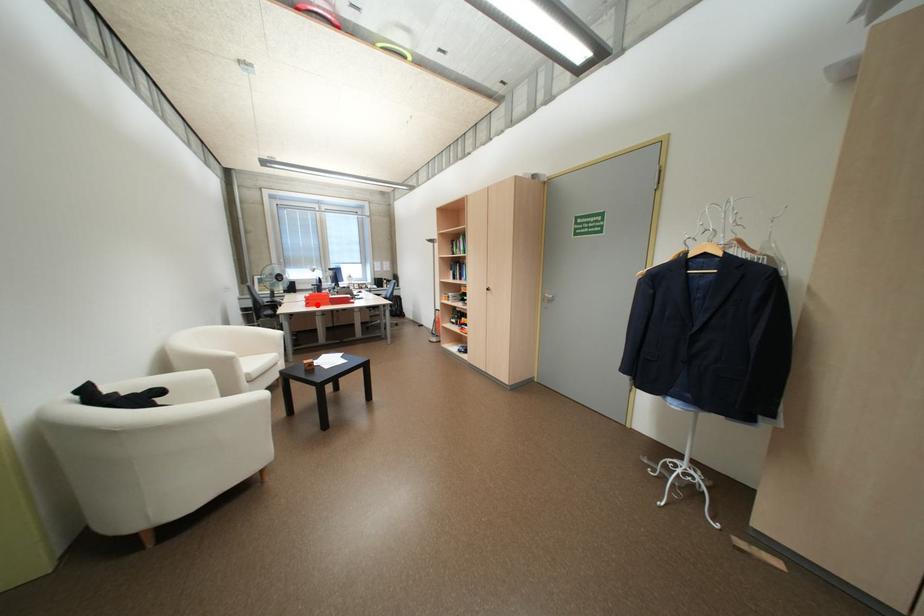
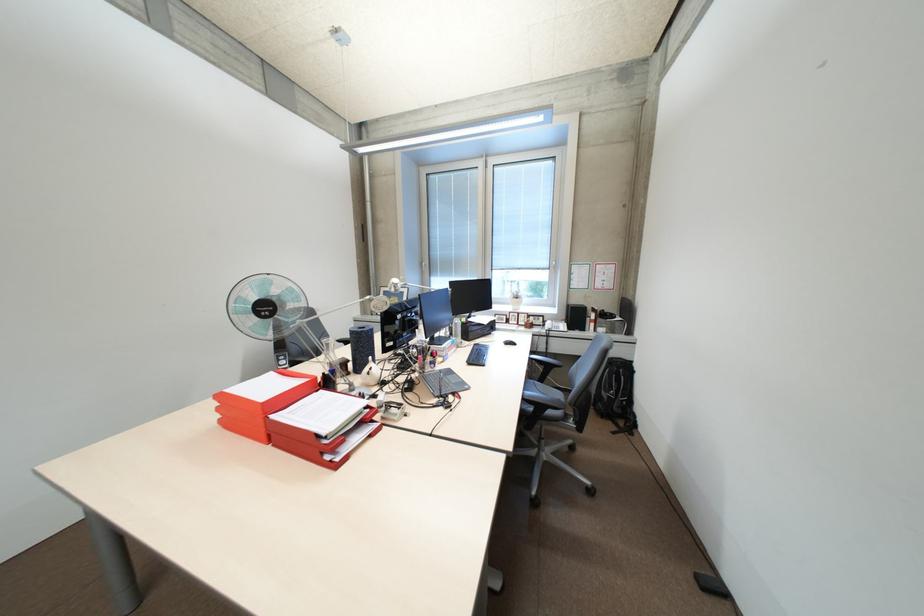
Where in the second image is the point corresponding to the highlighted location from the first image?

(231, 421)